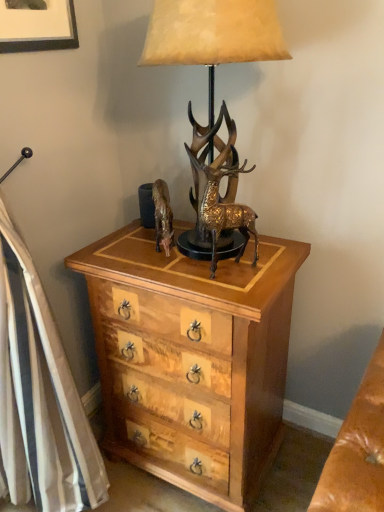
This screenshot has height=512, width=384. I want to click on free space above wooden chest of drawers at center (from a real-world perspective), so click(176, 255).